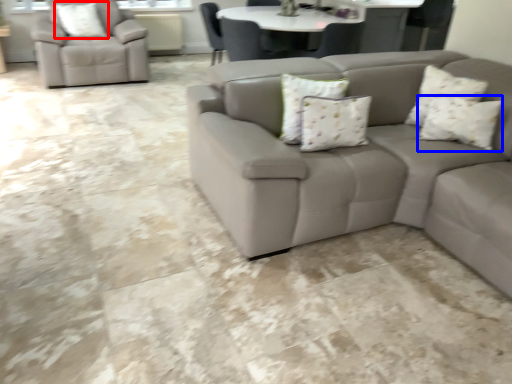
Question: Which point is further to the camera, pillow (highlighted by a red box) or pillow (highlighted by a blue box)?

Choices:
 (A) pillow
 (B) pillow

Answer: (A)